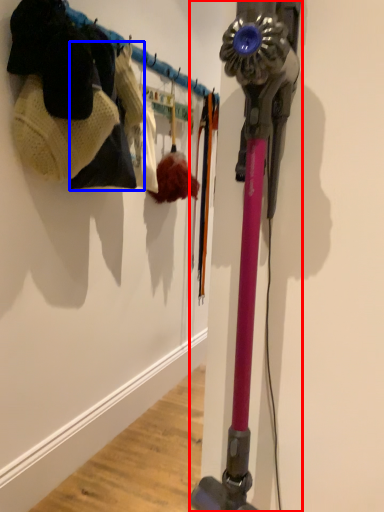
Question: Which point is further to the camera, vacuum (highlighted by a red box) or clothing (highlighted by a blue box)?

Choices:
 (A) vacuum
 (B) clothing

Answer: (B)